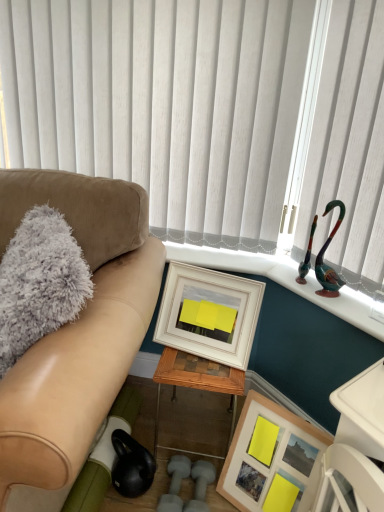
At what (x,y) coordinates should I click in order to perform the action: click on free location in front of matte white picture frame at center, which appears as the second picture frame when ordered from the bottom. Please return your answer as a coordinate pair (x, y). The height and width of the screenshot is (512, 384). Looking at the image, I should click on (200, 369).